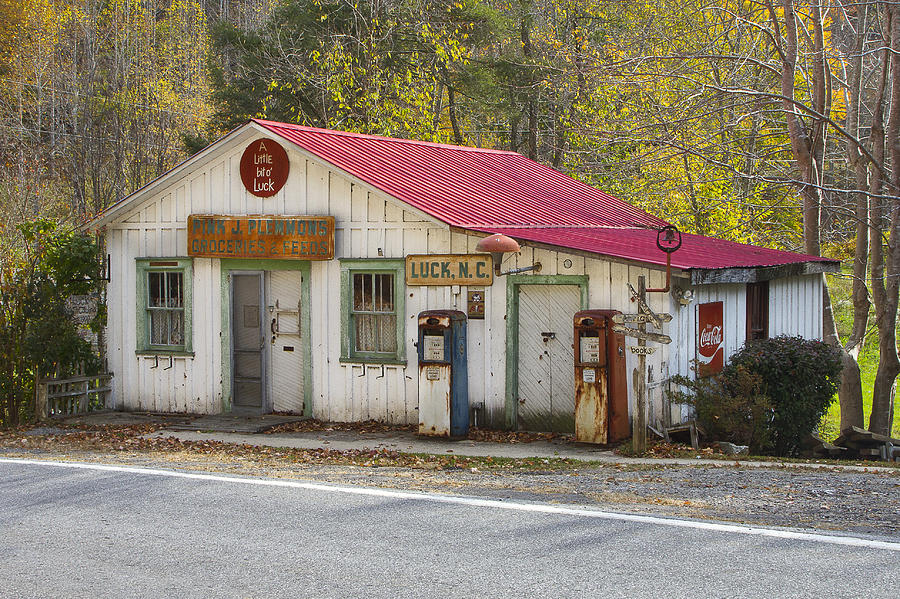
Identify the location of window. (168, 296), (358, 300), (757, 308).